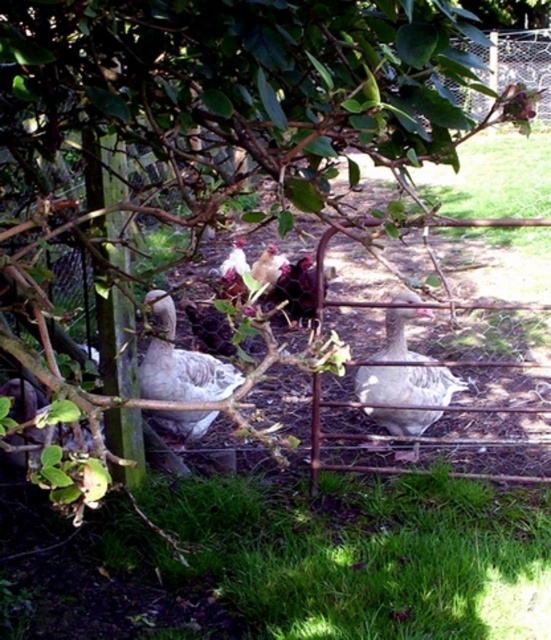
Is point (386, 416) farther from viewer compared to point (223, 269)?

That is False.

What are the coordinates of `white matte goose at center` in the screenshot? It's located at (406, 385).

Between point (397, 340) and point (222, 284), which one is positioned in front?

Point (397, 340) is in front.

At what (x,y) coordinates should I click in order to perform the action: click on white matte goose at center. Please return your answer as a coordinate pair (x, y). The image size is (551, 640). Looking at the image, I should click on (406, 385).

Does green grass at lower center appear under white matte goose at center?

Yes.

Is point (530, 611) positioned after point (372, 413)?

No, it is not.

Where is `green grass at lower center`? green grass at lower center is located at coordinates (283, 561).

Can you confirm if green grass at lower center is wider than white glossy chicken at center?

Yes.

Is green grass at lower center positioned behind white glossy chicken at center?

No, it is in front of white glossy chicken at center.

Who is more forward, (337, 579) or (234, 240)?

Point (337, 579) is in front.

Find the location of a particular element. green grass at lower center is located at coordinates (283, 561).